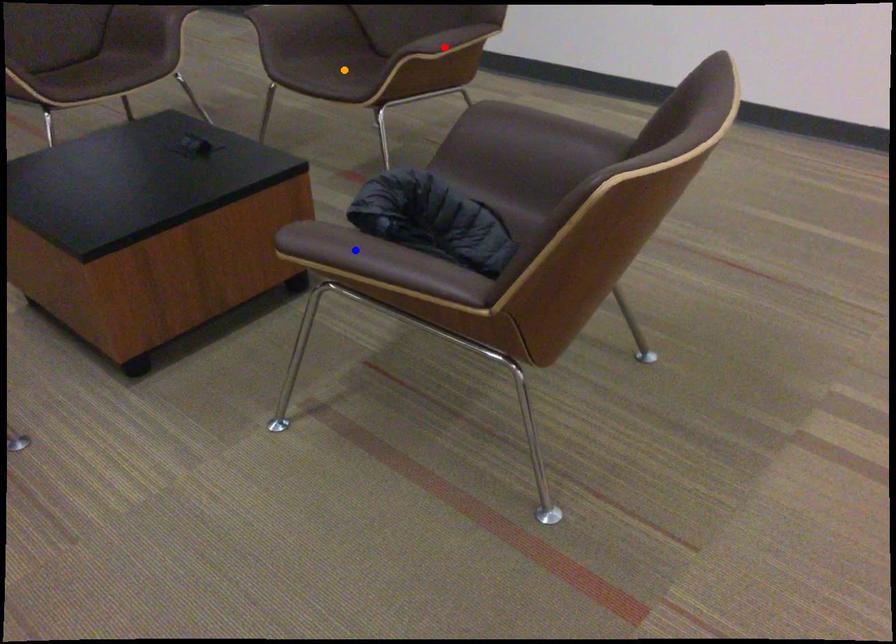
Order these from nearest to farthest:
orange point | red point | blue point

blue point, red point, orange point